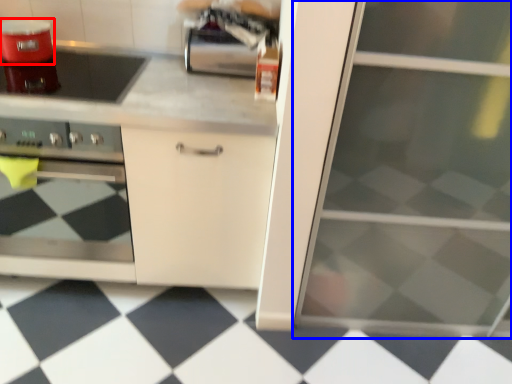
Question: Which object appears closest to the camera in this image, kitchen appliance (highlighted by a red box) or screen door (highlighted by a blue box)?

Choices:
 (A) kitchen appliance
 (B) screen door

Answer: (B)